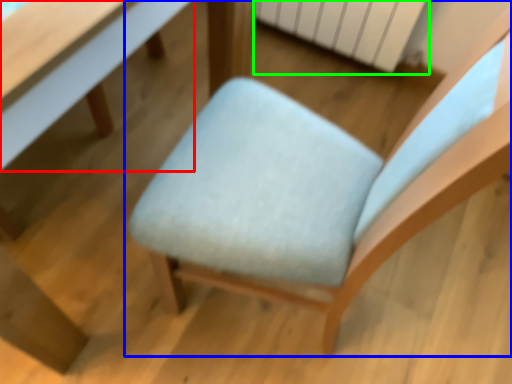
Question: Which is farther away from table (highlighted by a red box)? chair (highlighted by a blue box) or radiator (highlighted by a green box)?

Choices:
 (A) chair
 (B) radiator

Answer: (B)